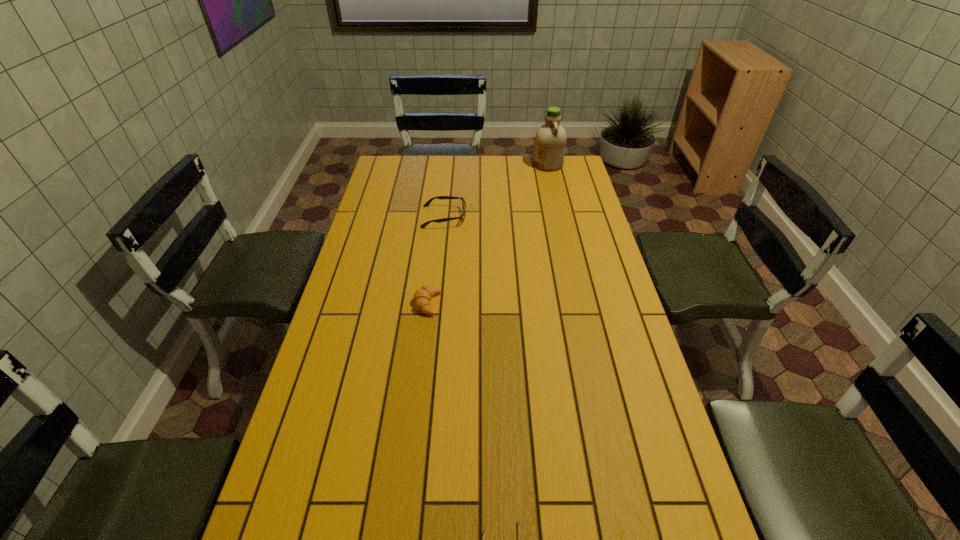
Find the location of a particular element. This screenshot has width=960, height=540. object that is at the right edge is located at coordinates (550, 141).

At what (x,y) coordinates should I click in order to perform the action: click on object that is positioned at the far right corner. Please return your answer as a coordinate pair (x, y). Looking at the image, I should click on click(x=550, y=141).

Identify the location of free space at the far edge. (475, 179).

This screenshot has height=540, width=960. Identify the location of vacant space at the left edge of the desktop. (372, 263).

I want to click on vacant space at the right edge of the desktop, so click(558, 221).

The height and width of the screenshot is (540, 960). Identify the location of vacant space at the far left corner of the desktop. (399, 156).

Locate an element on the screen. This screenshot has width=960, height=540. empty location between the second farthest object and the third farthest object is located at coordinates click(x=436, y=260).

Identify the location of free spot between the crescent roll and the spectacles. (436, 260).

In order to click on free space that is in between the second farthest object and the crescent roll in this screenshot , I will do `click(436, 260)`.

At what (x,y) coordinates should I click in order to perform the action: click on empty space that is in between the farthest object and the third nearest object. Please return your answer as a coordinate pair (x, y). Looking at the image, I should click on (496, 191).